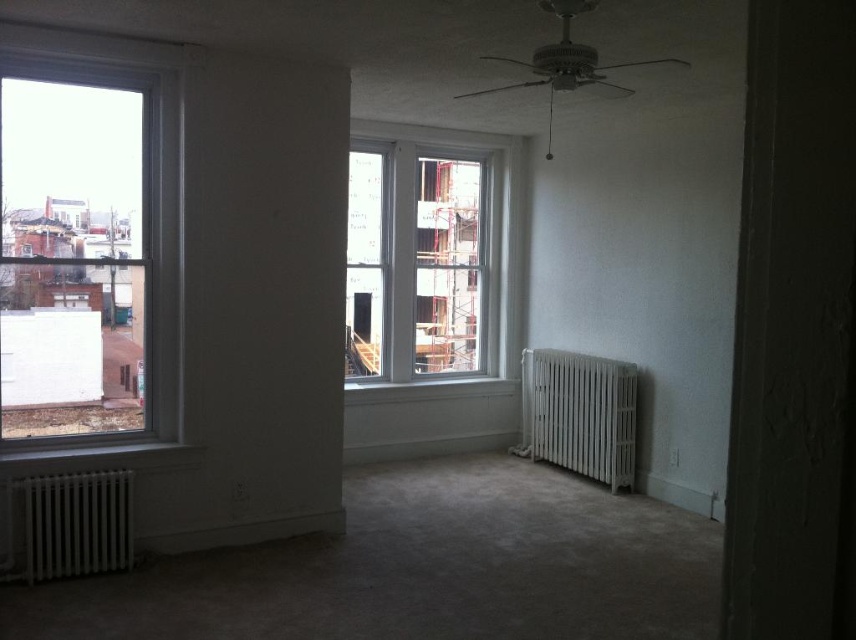
Question: Which object appears farthest from the camera in this image?

Choices:
 (A) white matte radiator at lower left
 (B) white matte radiator at lower right

Answer: (B)

Question: Can you confirm if clear glass window at left is wider than white wooden window at center?

Choices:
 (A) no
 (B) yes

Answer: (A)

Question: Among these points, which one is farthest from the camera?

Choices:
 (A) (548, 435)
 (B) (91, 61)

Answer: (A)

Question: Which of the following is the closest to the observer?

Choices:
 (A) [64, 419]
 (B) [527, 400]
 (C) [36, 508]
 (D) [387, 250]

Answer: (C)

Question: Does white matte radiator at lower right have a smaller size compared to white matte radiator at lower left?

Choices:
 (A) yes
 (B) no

Answer: (B)

Question: Can you confirm if white wooden window at center is thinner than white matte radiator at lower right?

Choices:
 (A) no
 (B) yes

Answer: (A)